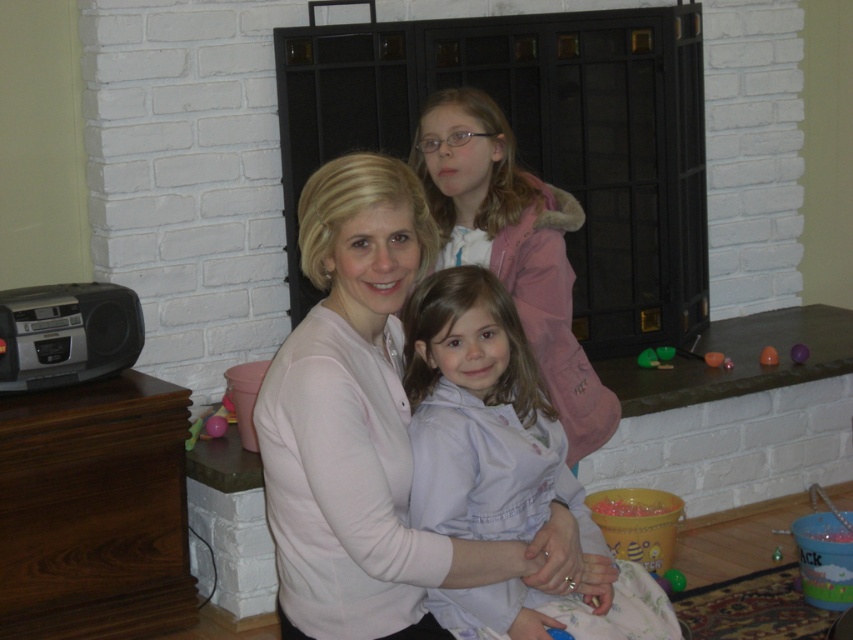
You are an interior designer arranging a living room. You have a matte pink sweater at center and a light blue fabric at center. According to the scene, where should you place the matte pink sweater in relation to the light blue fabric?

The matte pink sweater at center should be placed above the light blue fabric at center as it is located above it in the scene.

You are organizing a photo shoot and need to ensure that the matte pink sweater at center and the light blue fabric at center are visible in the frame. Based on their sizes, which object should you focus on first to ensure it fits within the camera view?

The matte pink sweater at center is taller than the light blue fabric at center, so you should focus on positioning the camera to include the matte pink sweater at center first to ensure it fits within the frame.